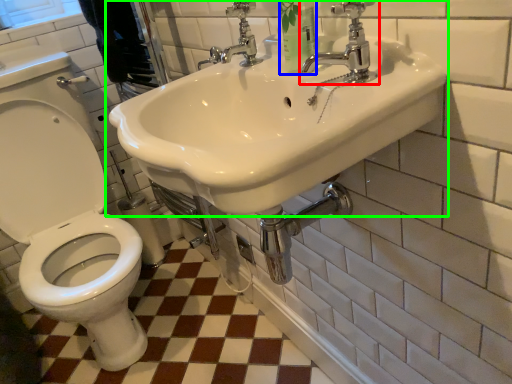
Question: Which object is positioned farthest from tap (highlighted by a red box)? Select from toiletry (highlighted by a blue box) and sink (highlighted by a green box).

Choices:
 (A) toiletry
 (B) sink

Answer: (B)